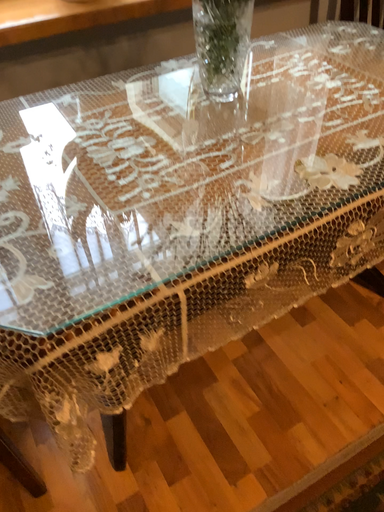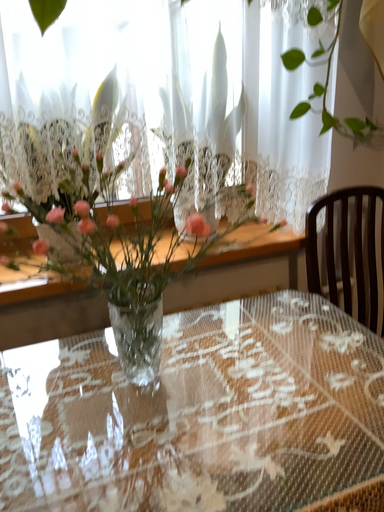
Question: How did the camera likely rotate when shooting the video?

Choices:
 (A) rotated left
 (B) rotated right

Answer: (A)